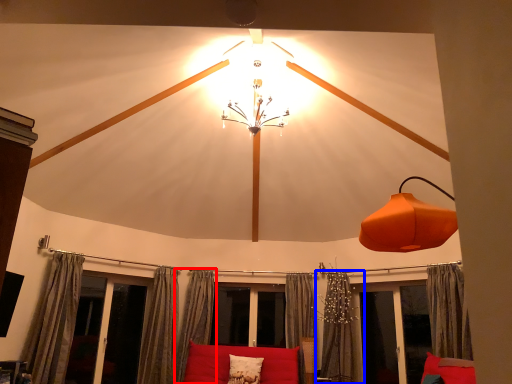
Question: Which of the following is the closest to the observer, curtain (highlighted by a red box) or curtain (highlighted by a blue box)?

Choices:
 (A) curtain
 (B) curtain

Answer: (B)